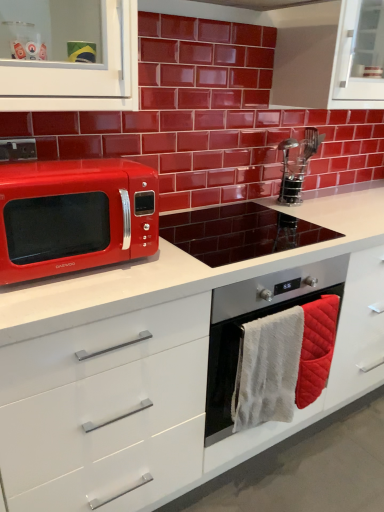
Question: Considering the relative sizes of glossy ceramic microwave at left and shiny red microwave at left in the image provided, is glossy ceramic microwave at left bigger than shiny red microwave at left?

Choices:
 (A) yes
 (B) no

Answer: (A)

Question: Does glossy ceramic microwave at left lie in front of shiny red microwave at left?

Choices:
 (A) yes
 (B) no

Answer: (B)

Question: Are glossy ceramic microwave at left and shiny red microwave at left far apart?

Choices:
 (A) yes
 (B) no

Answer: (B)

Question: Considering the relative sizes of glossy ceramic microwave at left and shiny red microwave at left in the image provided, is glossy ceramic microwave at left smaller than shiny red microwave at left?

Choices:
 (A) yes
 (B) no

Answer: (B)

Question: From a real-world perspective, is glossy ceramic microwave at left physically above shiny red microwave at left?

Choices:
 (A) yes
 (B) no

Answer: (A)

Question: Does glossy ceramic microwave at left have a greater width compared to shiny red microwave at left?

Choices:
 (A) yes
 (B) no

Answer: (B)

Question: Considering the relative sizes of stainless steel oven at center and stainless steel oven at center in the image provided, is stainless steel oven at center shorter than stainless steel oven at center?

Choices:
 (A) yes
 (B) no

Answer: (B)

Question: Considering the relative positions of stainless steel oven at center and stainless steel oven at center in the image provided, is stainless steel oven at center behind stainless steel oven at center?

Choices:
 (A) yes
 (B) no

Answer: (B)

Question: From the image's perspective, does stainless steel oven at center appear lower than stainless steel oven at center?

Choices:
 (A) yes
 (B) no

Answer: (A)

Question: Is stainless steel oven at center smaller than stainless steel oven at center?

Choices:
 (A) yes
 (B) no

Answer: (B)

Question: Considering the relative sizes of stainless steel oven at center and stainless steel oven at center in the image provided, is stainless steel oven at center taller than stainless steel oven at center?

Choices:
 (A) yes
 (B) no

Answer: (A)

Question: From the image's perspective, would you say stainless steel oven at center is positioned over stainless steel oven at center?

Choices:
 (A) yes
 (B) no

Answer: (B)

Question: Is white glossy countertop at center oriented away from quilted cotton hand towel at lower right, the first hand towel viewed from the right?

Choices:
 (A) yes
 (B) no

Answer: (A)